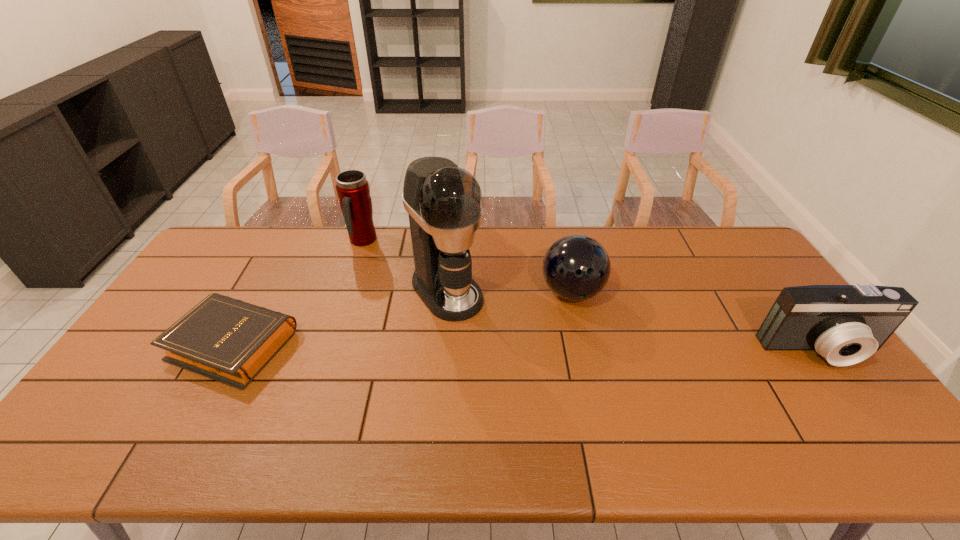
Where is `vacant space on the desktop that is between the Bible and the rightmost object and is positioned place cup under the spout of the tallest object`? The width and height of the screenshot is (960, 540). vacant space on the desktop that is between the Bible and the rightmost object and is positioned place cup under the spout of the tallest object is located at coordinates (493, 347).

I want to click on free space on the desktop that is between the shortest object and the camcorder and is positioned on the side of the fourth object from left to right with the finger holes, so click(603, 348).

Identify the location of vacant space on the desktop that is between the leftmost object and the camcorder and is positioned on the side with the handle of the second object from left to right. (442, 346).